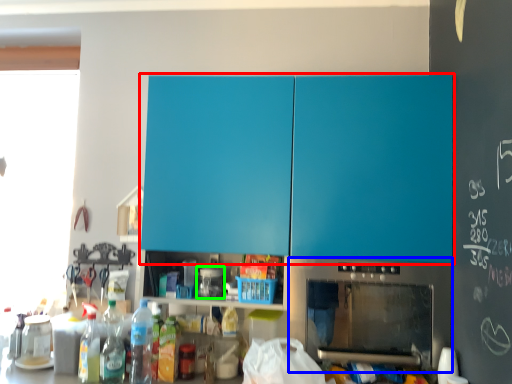
Question: Estimate the real-world distances between objects in this image. Which object is closer to cabinetry (highlighted by a red box), home appliance (highlighted by a blue box) or appliance (highlighted by a green box)?

Choices:
 (A) home appliance
 (B) appliance

Answer: (A)